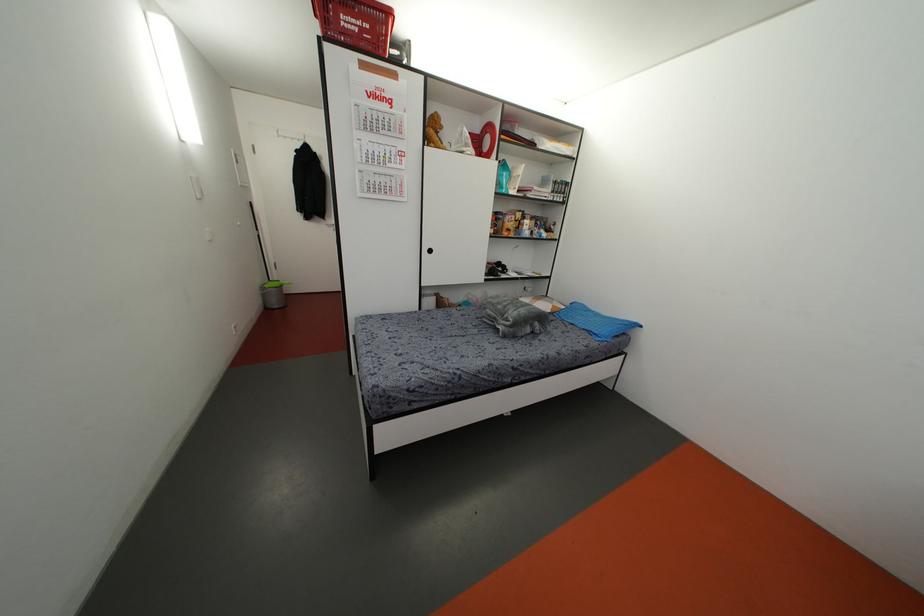
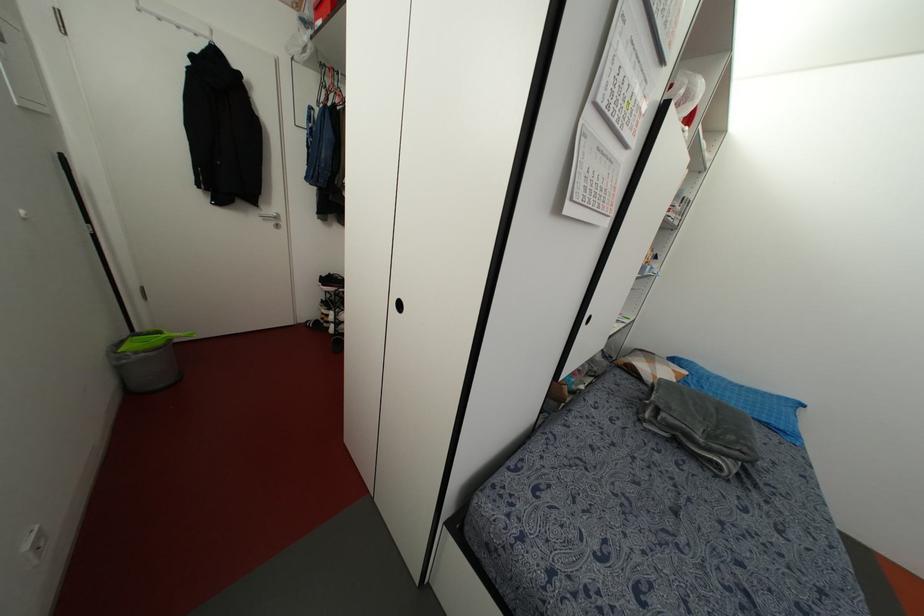
What movement of the cameraman would produce the second image?

The cameraman walked toward left, forward.